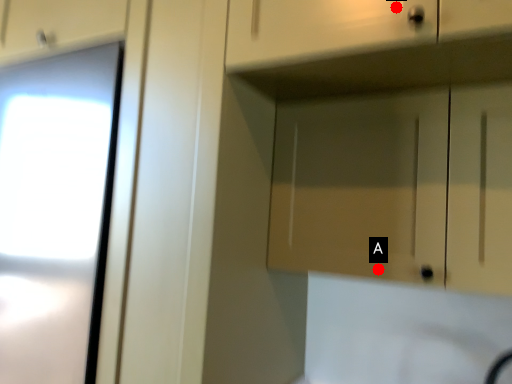
Question: Two points are circled on the image, labeled by A and B beside each circle. Which point is closer to the camera?

Choices:
 (A) A is closer
 (B) B is closer

Answer: (B)